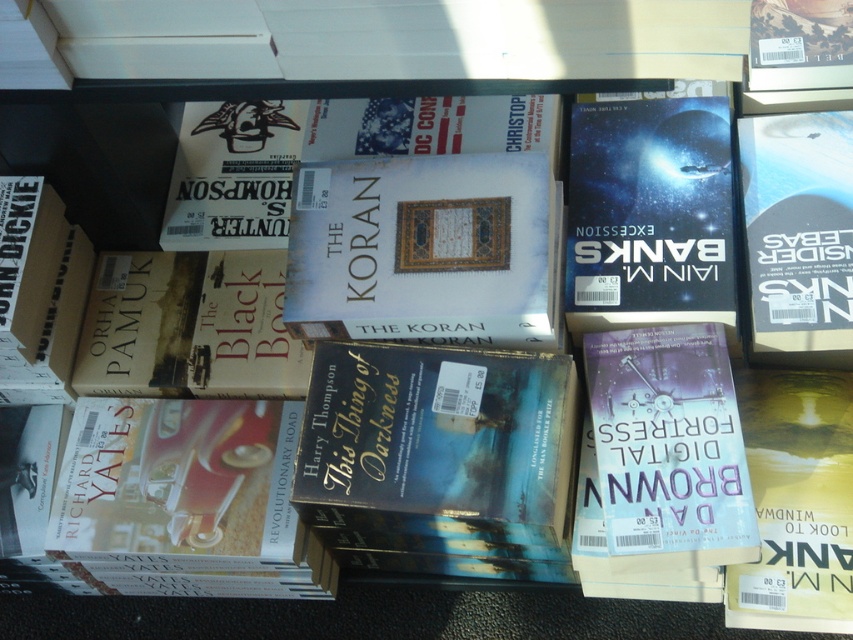
Question: Which object is farther from the camera taking this photo?

Choices:
 (A) shiny blue cover at center
 (B) hardcover book at right
 (C) white matte book at center

Answer: (A)

Question: Which object appears farthest from the camera in this image?

Choices:
 (A) shiny blue cover at center
 (B) hardcover book at right

Answer: (A)

Question: Which of the following is the farthest from the observer?

Choices:
 (A) (701, 100)
 (B) (444, 236)

Answer: (A)

Question: Can you confirm if blue matte book at center is positioned to the left of white matte book at center?

Choices:
 (A) no
 (B) yes

Answer: (A)

Question: Is the position of shiny blue cover at center more distant than that of hardcover book at right?

Choices:
 (A) no
 (B) yes

Answer: (B)

Question: Is white matte book at center positioned behind hardcover book at right?

Choices:
 (A) yes
 (B) no

Answer: (B)